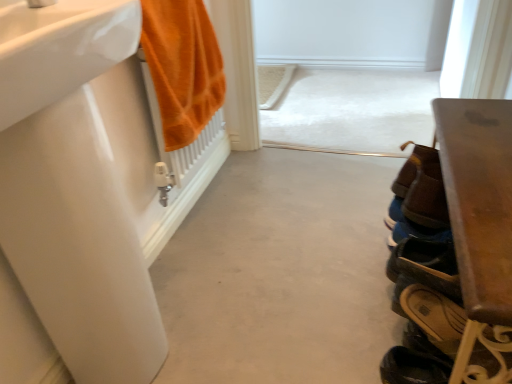
Question: Should I look upward or downward to see brown leather shoe at lower right, the first shoe viewed from the front?

Choices:
 (A) up
 (B) down

Answer: (A)

Question: Is beige leather sandals at lower right, placed as the 1th footwear when sorted from bottom to top, not close to brown leather shoe at lower right, marked as the second shoe in a front-to-back arrangement?

Choices:
 (A) no
 (B) yes

Answer: (A)

Question: Can you confirm if beige leather sandals at lower right, positioned as the second footwear in top-to-bottom order, is bigger than brown leather shoe at lower right, marked as the second shoe in a front-to-back arrangement?

Choices:
 (A) yes
 (B) no

Answer: (B)

Question: Is beige leather sandals at lower right, positioned as the second footwear in top-to-bottom order, further to camera compared to brown leather shoe at lower right, the first shoe positioned from the back?

Choices:
 (A) no
 (B) yes

Answer: (A)

Question: From a real-world perspective, is beige leather sandals at lower right, positioned as the second footwear in top-to-bottom order, beneath brown leather shoe at lower right, marked as the second shoe in a front-to-back arrangement?

Choices:
 (A) yes
 (B) no

Answer: (A)

Question: Considering the relative positions of beige leather sandals at lower right, positioned as the second footwear in top-to-bottom order, and brown leather shoe at lower right, the first shoe positioned from the back, in the image provided, is beige leather sandals at lower right, positioned as the second footwear in top-to-bottom order, in front of brown leather shoe at lower right, the first shoe positioned from the back,?

Choices:
 (A) no
 (B) yes

Answer: (B)

Question: Is beige leather sandals at lower right, positioned as the second footwear in top-to-bottom order, to the right of brown leather shoe at lower right, the first shoe positioned from the back, from the viewer's perspective?

Choices:
 (A) yes
 (B) no

Answer: (B)

Question: Is orange cotton towel at left oriented away from gray matte concrete at center?

Choices:
 (A) no
 (B) yes

Answer: (A)

Question: From a real-world perspective, is orange cotton towel at left physically above gray matte concrete at center?

Choices:
 (A) no
 (B) yes

Answer: (B)

Question: Considering the relative sizes of orange cotton towel at left and gray matte concrete at center in the image provided, is orange cotton towel at left wider than gray matte concrete at center?

Choices:
 (A) yes
 (B) no

Answer: (B)

Question: From the image's perspective, is orange cotton towel at left located beneath gray matte concrete at center?

Choices:
 (A) yes
 (B) no

Answer: (B)

Question: Is orange cotton towel at left shorter than gray matte concrete at center?

Choices:
 (A) yes
 (B) no

Answer: (B)

Question: Can you confirm if orange cotton towel at left is thinner than gray matte concrete at center?

Choices:
 (A) no
 (B) yes

Answer: (B)

Question: From a real-world perspective, does gray matte concrete at center stand above brown leather shoe at lower right, the first shoe positioned from the back?

Choices:
 (A) yes
 (B) no

Answer: (B)